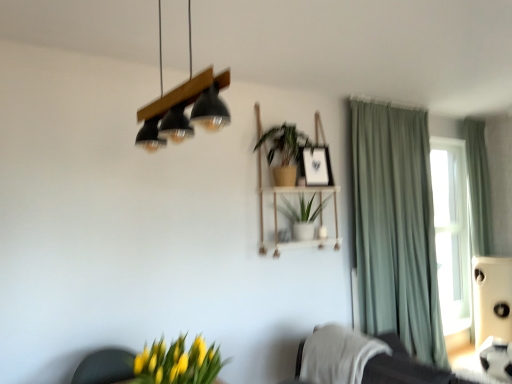
Question: Is green matte plant at center, which is the 1th houseplant from top to bottom, inside the boundaries of green matte plant at center, which ranks as the first houseplant in back-to-front order, or outside?

Choices:
 (A) inside
 (B) outside

Answer: (B)

Question: From a real-world perspective, is green matte plant at center, the second houseplant in the back-to-front sequence, above or below green matte plant at center, the second houseplant when ordered from top to bottom?

Choices:
 (A) above
 (B) below

Answer: (A)

Question: Considering the real-world distances, which object is farthest from the green fabric curtain at right, the 1th curtain when ordered from front to back?

Choices:
 (A) matte black picture frame at upper center
 (B) white textured blanket at lower right
 (C) woodenblacklamp at upper center
 (D) white textured towel at lower right
 (E) yellow-green leaves at lower left, which appears as the 3th houseplant when viewed from the back

Answer: (C)

Question: Which object is positioned closest to the white textured towel at lower right?

Choices:
 (A) woodenblacklamp at upper center
 (B) green fabric curtain at right, the 2th curtain in the right-to-left sequence
 (C) white textured blanket at lower right
 (D) green fabric curtain at right, which is counted as the second curtain, starting from the left
 (E) yellow-green leaves at lower left, which is counted as the third houseplant, starting from the top

Answer: (C)